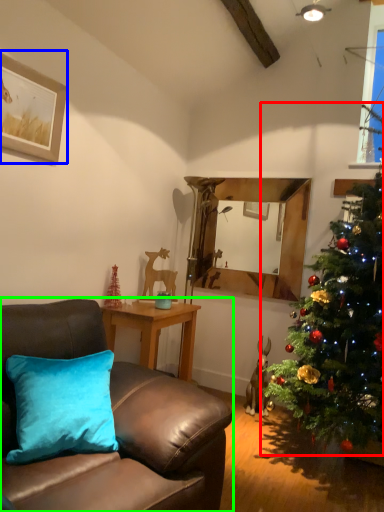
Question: Estimate the real-world distances between objects in this image. Which object is farther from christmas tree (highlighted by a red box), picture frame (highlighted by a blue box) or studio couch (highlighted by a green box)?

Choices:
 (A) picture frame
 (B) studio couch

Answer: (A)